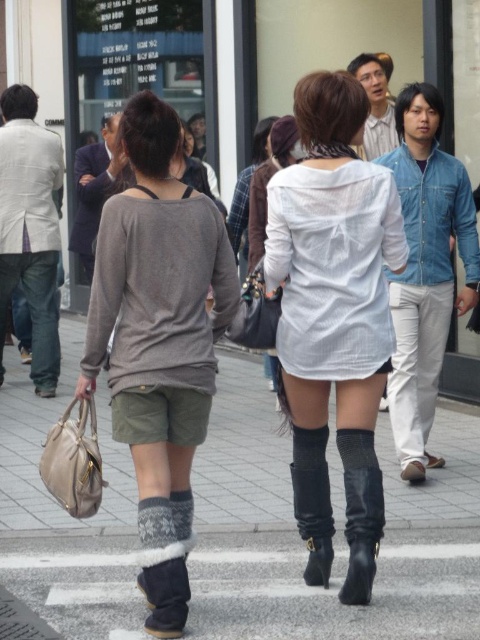
You are a photographer trying to capture both the white textured shirt at center and the gray woolen sweater at center in a single frame. Based on their sizes, which one should you focus on to ensure both fit comfortably in the photo?

The white textured shirt at center has a lesser width compared to the gray woolen sweater at center, so focusing on the larger gray woolen sweater at center will help ensure both fit comfortably in the photo.

You are a delivery robot that needs to navigate between the white textured shirt at center and the black rubber boots at lower center. The robot is 0.5 meters wide. Can you safely pass through the space between them without touching either?

The distance between the white textured shirt at center and the black rubber boots at lower center is 1.04 meters. Since the robot is 0.5 meters wide, there is enough space for it to pass safely without touching either object.